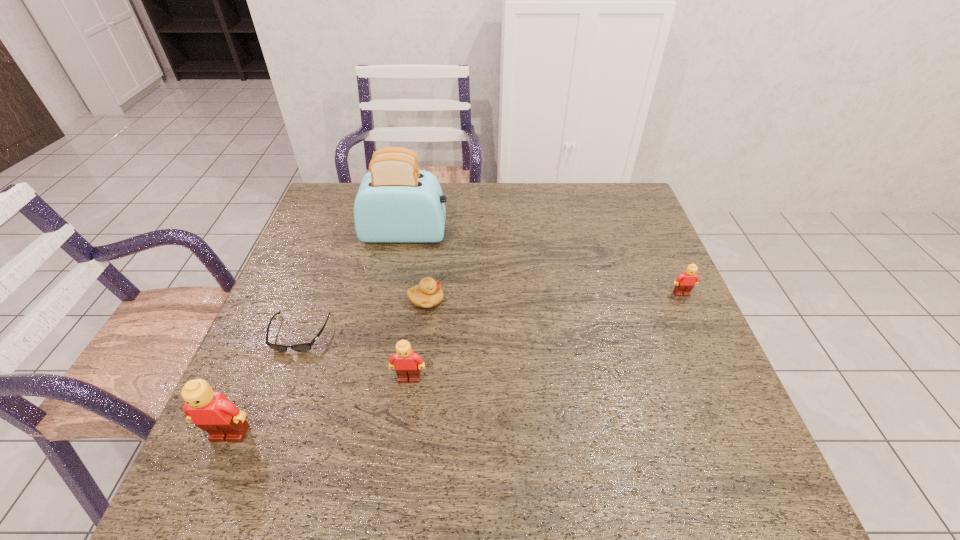
To achieve uniform spacing by inserting another Lego among them, please point to a free space for this new Lego. Please provide its 2D coordinates. Your answer should be formatted as a tuple, i.e. [(x, y)], where the tuple contains the x and y coordinates of a point satisfying the conditions above.

[(557, 332)]